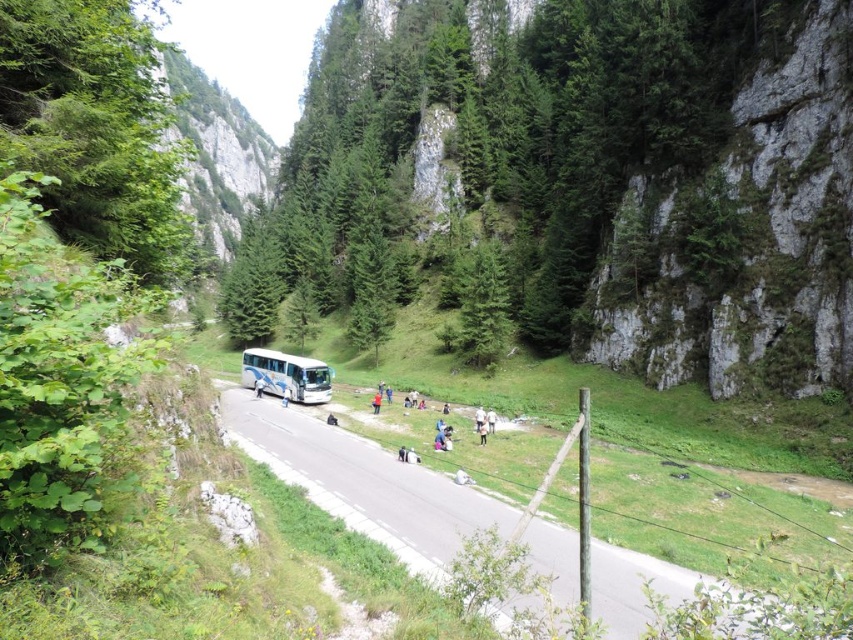
You are standing at the point labeled point (341, 444) and want to walk to point (315, 396). Given that the distance between these two points is 10 meters, will you be moving towards the camera or away from it as you walk?

As you walk from point (341, 444) to point (315, 396), you will be moving away from the camera since point (315, 396) is farther from the camera than point (341, 444).

You are a hiker who wants to take a photo of the green leafy tree at left from the road. Based on its position, can you estimate whether the tree is closer to the road or further away from it?

The green leafy tree at left is located at point (96, 129), which suggests it is positioned closer to the road compared to the background elements, so it should be accessible for a photo from the road.

Looking at this image, you are a hiker planning to take a photo of the white asphalt road at center from the green leafy tree at left. Considering the height difference between them, will the tree block your view of the road?

The green leafy tree at left is much taller than the white asphalt road at center, so it might block your view depending on the angle and distance. However, since the road is at the center and the tree is on the left, you could position yourself to the right of the tree to frame the shot without obstruction.